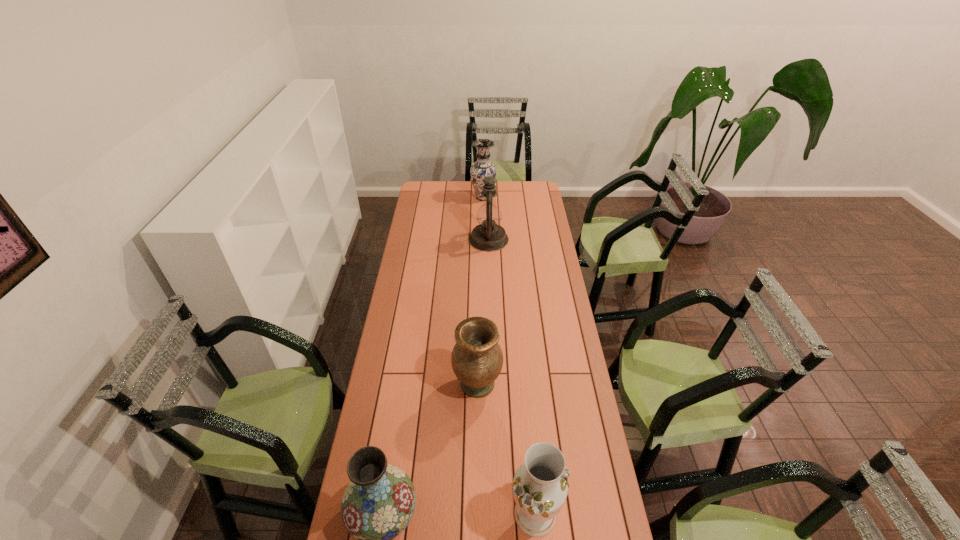
The height and width of the screenshot is (540, 960). In order to click on blank region between the second farthest vase and the oil lamp in this screenshot , I will do `click(483, 312)`.

This screenshot has width=960, height=540. I want to click on free space between the farthest object and the third farthest object, so click(x=480, y=291).

Identify the location of vacant space that's between the third farthest object and the farthest object. This screenshot has height=540, width=960. (480, 291).

Locate which object ranks fourth in proximity to the farthest vase. Please provide its 2D coordinates. Your answer should be formatted as a tuple, i.e. [(x, y)], where the tuple contains the x and y coordinates of a point satisfying the conditions above.

[(540, 486)]

The image size is (960, 540). What are the coordinates of `object that is the second closest to the leftmost vase` in the screenshot? It's located at (477, 359).

Select which vase appears as the second closest to the oil lamp. Please provide its 2D coordinates. Your answer should be formatted as a tuple, i.e. [(x, y)], where the tuple contains the x and y coordinates of a point satisfying the conditions above.

[(477, 359)]

Identify which vase is the third nearest to the farthest object. Please provide its 2D coordinates. Your answer should be formatted as a tuple, i.e. [(x, y)], where the tuple contains the x and y coordinates of a point satisfying the conditions above.

[(540, 486)]